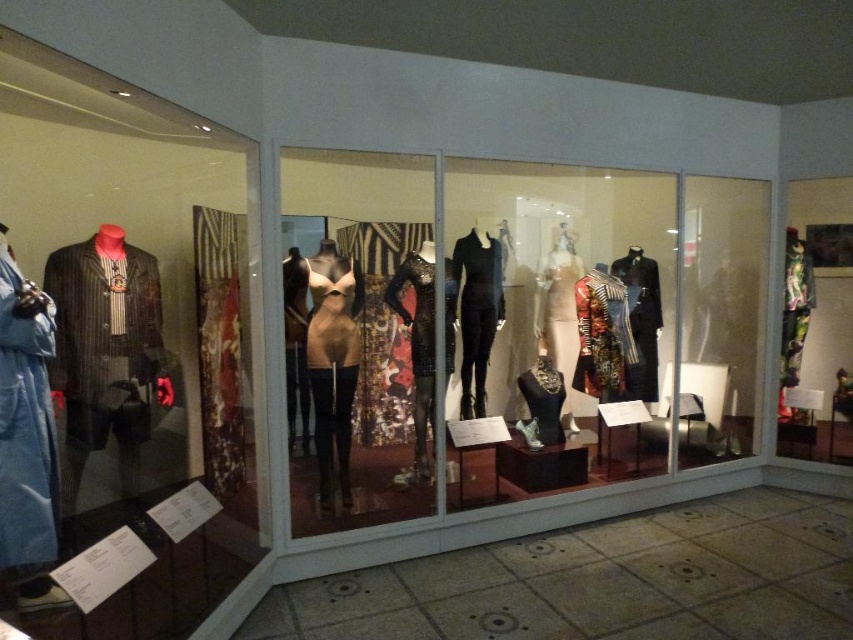
Question: Which object appears closest to the camera in this image?

Choices:
 (A) black matte dress at center
 (B) shiny metallic dress at center
 (C) striped fabric blazer at left
 (D) shiny metallic dress form at center

Answer: (C)

Question: Can you confirm if shiny metallic dress form at center is wider than matte beige top at center?

Choices:
 (A) yes
 (B) no

Answer: (A)

Question: Does shiny metallic dress form at center appear on the right side of matte beige dress form at center?

Choices:
 (A) yes
 (B) no

Answer: (A)

Question: Which of the following is the farthest from the observer?

Choices:
 (A) matte beige top at center
 (B) denim jacket at left
 (C) shiny black dress at center

Answer: (A)

Question: Which of the following is the closest to the observer?

Choices:
 (A) shiny metallic dress form at center
 (B) matte beige top at center
 (C) shiny metallic dress at center
 (D) striped fabric blazer at left

Answer: (D)

Question: Is shiny metallic dress form at center smaller than matte beige top at center?

Choices:
 (A) no
 (B) yes

Answer: (A)